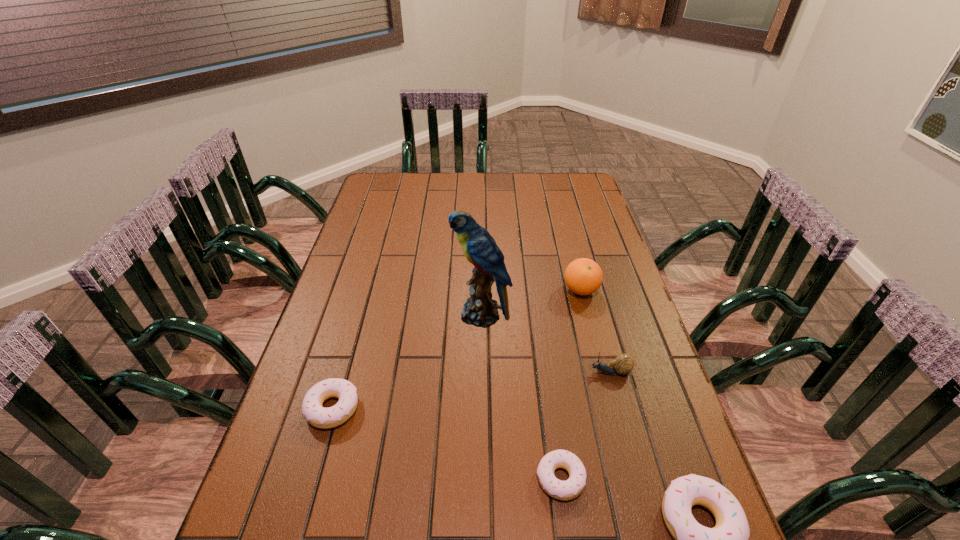
Where is `vacant space that satisfies the following two spatial constraints: 1. on the face of the parrot; 2. on the back side of the second doughnut from right to left`? This screenshot has width=960, height=540. vacant space that satisfies the following two spatial constraints: 1. on the face of the parrot; 2. on the back side of the second doughnut from right to left is located at coordinates (482, 478).